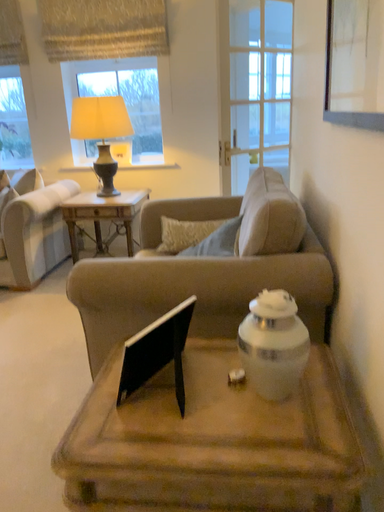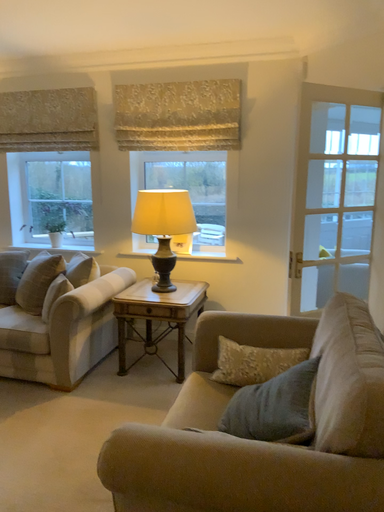
Question: Which way did the camera rotate in the video?

Choices:
 (A) rotated upward
 (B) rotated downward

Answer: (A)